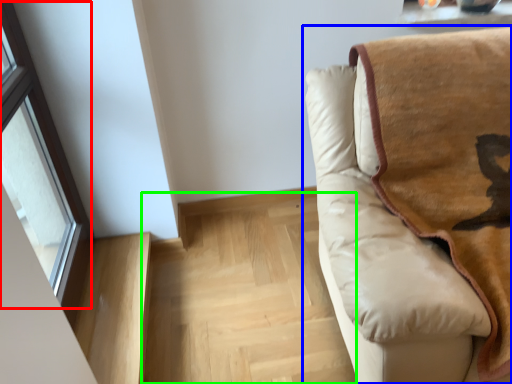
Question: Which object is positioned closest to window (highlighted by a red box)? Select from studio couch (highlighted by a blue box) and stairwell (highlighted by a green box).

Choices:
 (A) studio couch
 (B) stairwell

Answer: (B)